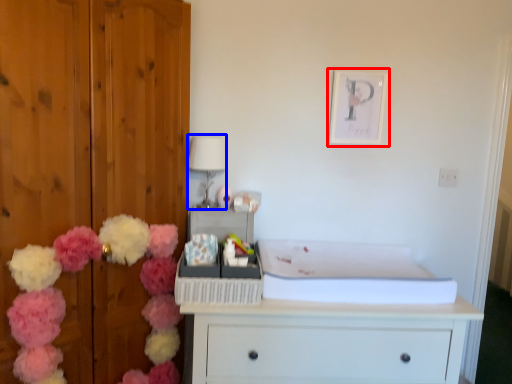
Question: Among these objects, which one is farthest to the camera, picture frame (highlighted by a red box) or lamp (highlighted by a blue box)?

Choices:
 (A) picture frame
 (B) lamp

Answer: (A)